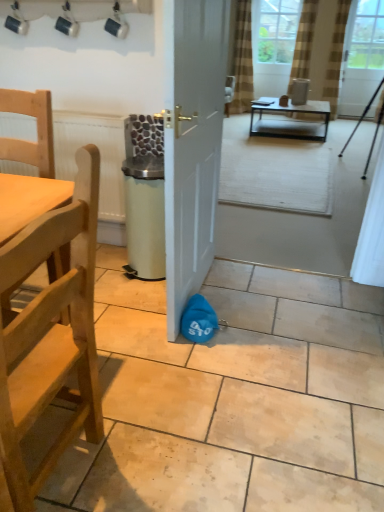
Locate an element on the screen. free spot below wooden chair at left, placed as the second chair when sorted from top to bottom (from a real-world perspective) is located at coordinates (58, 466).